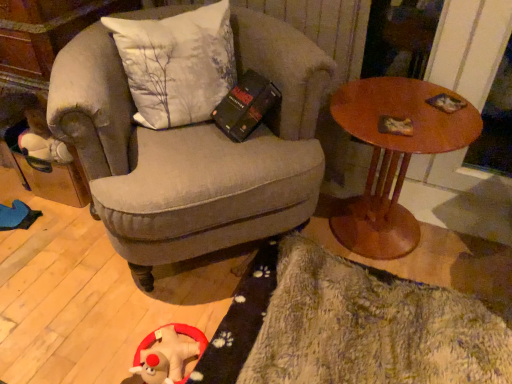
What are the coordinates of `free point below wooden round table at right (from a real-world perspective)` in the screenshot? It's located at (x=390, y=246).